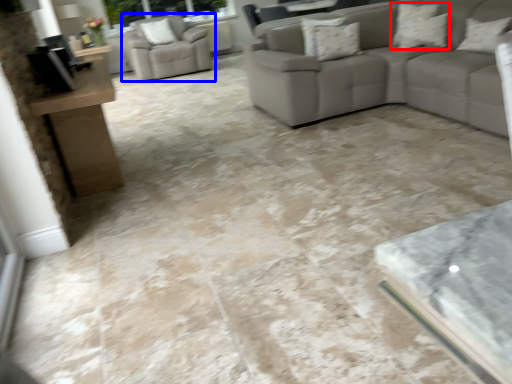
Question: Which point is closer to the camera, pillow (highlighted by a red box) or chair (highlighted by a blue box)?

Choices:
 (A) pillow
 (B) chair

Answer: (A)